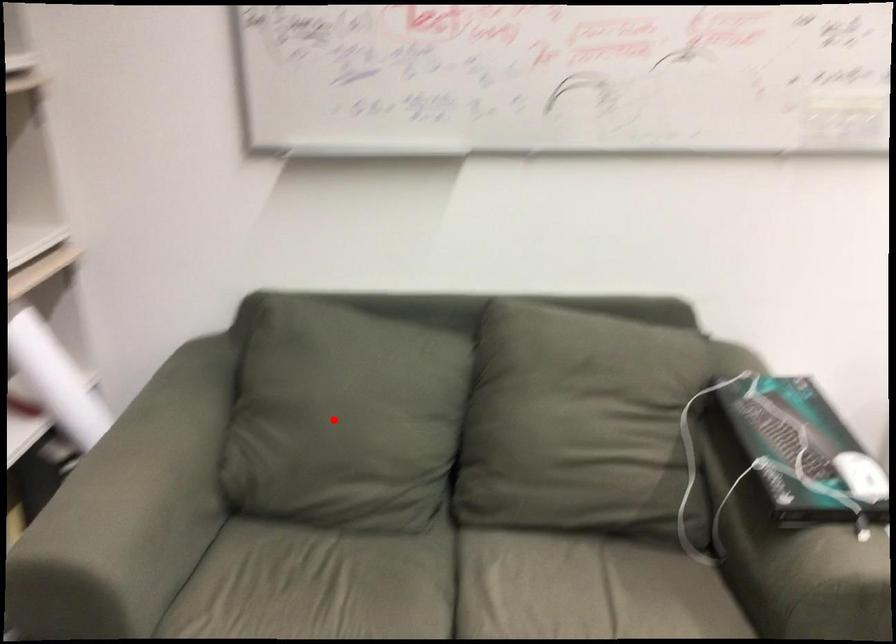
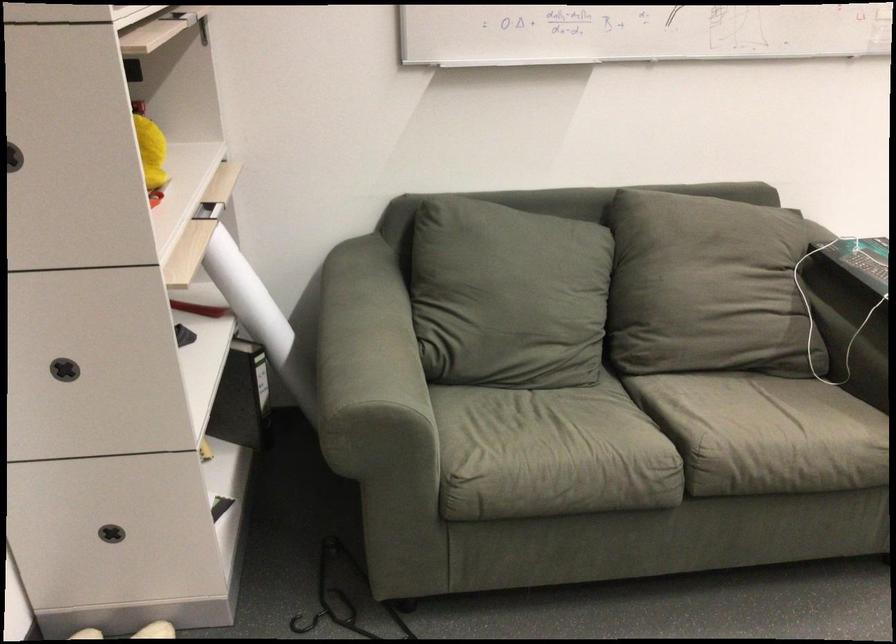
Question: I am providing you with two images of the same scene from different viewpoints. Image1 has a red point marked. In image2, the corresponding 3D location appears at what relative position? Reply with the corresponding letter.

Choices:
 (A) Closer
 (B) Farther

Answer: (B)